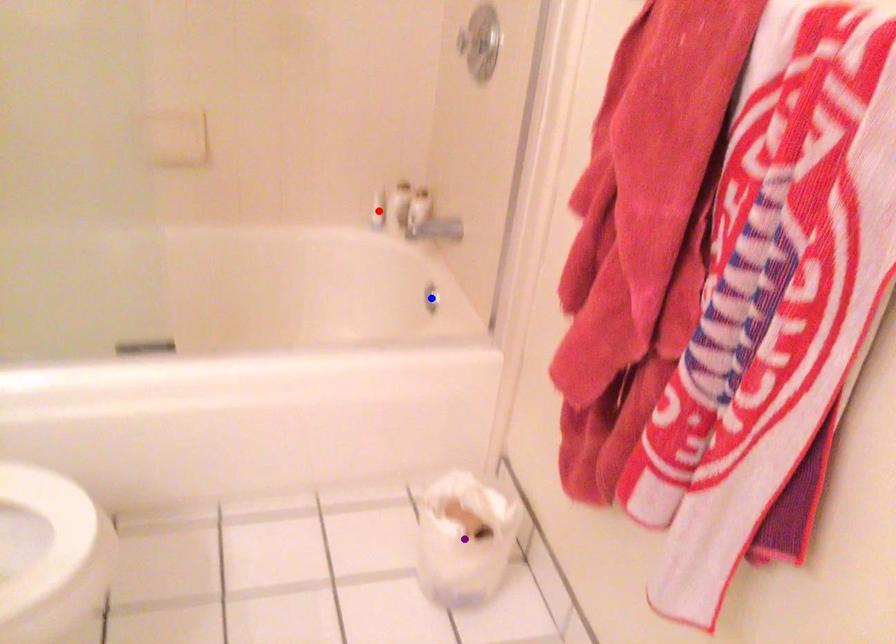
Order these from nearest to farthest:
red point, blue point, purple point

red point, blue point, purple point